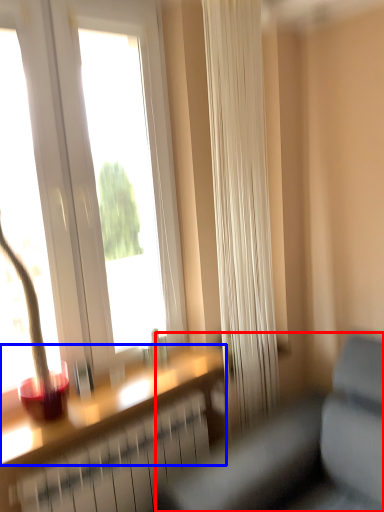
Question: Which point is closer to the camera, studio couch (highlighted by a red box) or window sill (highlighted by a blue box)?

Choices:
 (A) studio couch
 (B) window sill

Answer: (A)